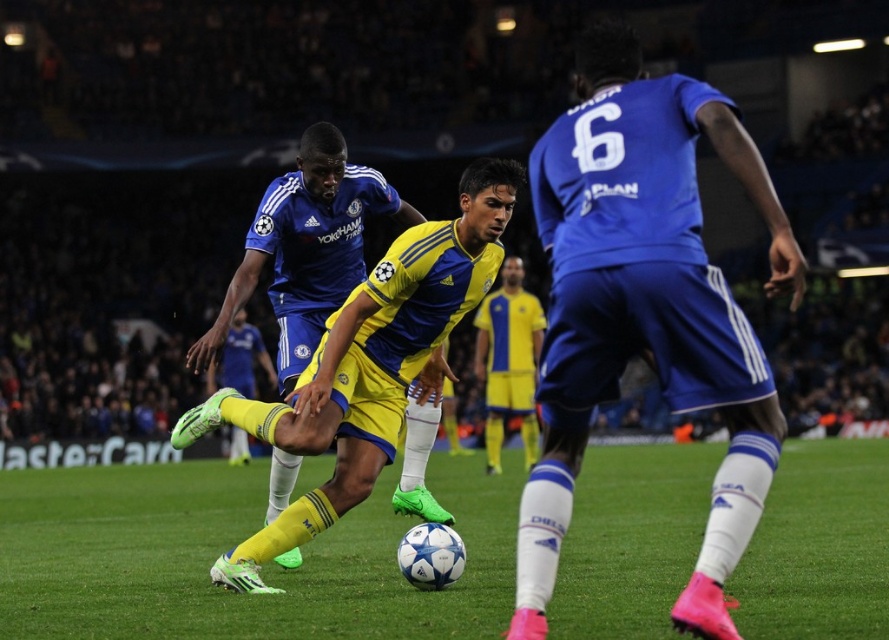
You are a soccer coach analyzing the play. You notice the green grass at center and the blue jersey at center. Which object is closer to the camera?

The green grass at center is closer to the camera because it is in front of the blue jersey at center.

You are a soccer coach analyzing the players on the field. You notice the yellow jersey at center and the yellow matte soccer cleat at center. Which of these two items is wider?

The yellow matte soccer cleat at center is wider than the yellow jersey at center.